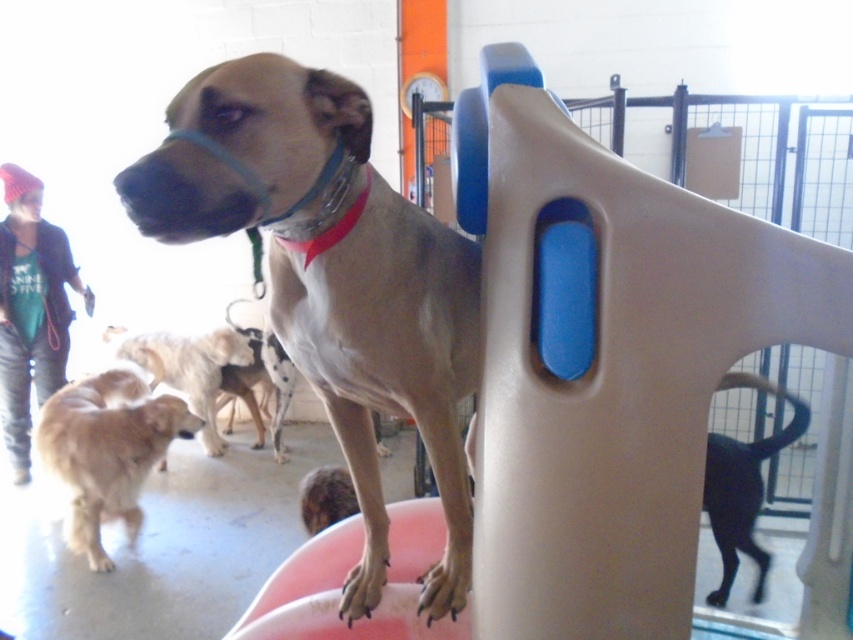
Between light brown fur at center and black glossy dog at lower right, which one is positioned lower?

black glossy dog at lower right is below.

Where is `light brown fur at center`? The image size is (853, 640). light brown fur at center is located at coordinates (334, 276).

Does point (368, 563) come behind point (779, 440)?

No, (368, 563) is in front of (779, 440).

Where is `light brown fur at center`? This screenshot has width=853, height=640. light brown fur at center is located at coordinates (334, 276).

Is golden fur dog at center taller than golden fur dog at lower left?

Yes, golden fur dog at center is taller than golden fur dog at lower left.

Consider the image. Can you confirm if golden fur dog at center is positioned below golden fur dog at lower left?

Yes.

Consider the image. Who is more forward, (42, 406) or (247, 353)?

Point (42, 406) is more forward.

Find the location of a particular element. golden fur dog at center is located at coordinates (106, 451).

Between point (318, 273) and point (190, 424), which one is positioned behind?

Positioned behind is point (190, 424).

Is light brown fur at center shorter than golden fur dog at center?

In fact, light brown fur at center may be taller than golden fur dog at center.

From the picture: Who is more forward, (138, 188) or (136, 476)?

Positioned in front is point (138, 188).

This screenshot has height=640, width=853. Find the location of `light brown fur at center`. light brown fur at center is located at coordinates (334, 276).